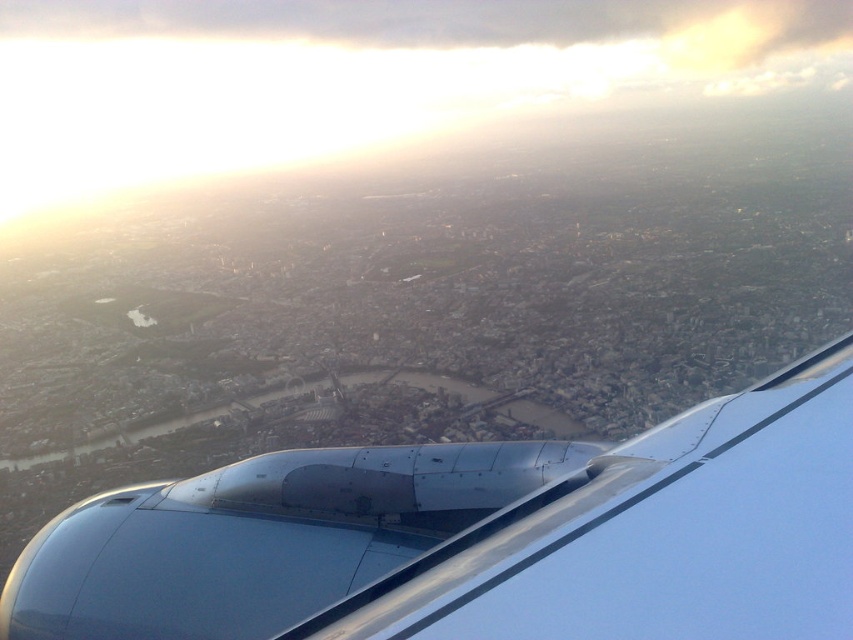
Question: Which point is farther from the camera taking this photo?

Choices:
 (A) (363, 467)
 (B) (453, 22)

Answer: (B)

Question: Where is metallic blue engine at lower right located in relation to transparent glass airplane window at lower left in the image?

Choices:
 (A) above
 (B) below

Answer: (B)

Question: Which object appears closest to the camera in this image?

Choices:
 (A) transparent glass airplane window at lower left
 (B) white fluffy cloud at upper center

Answer: (B)

Question: Which point is farther from the camera taking this photo?

Choices:
 (A) (111, 502)
 (B) (161, 524)
 (C) (112, 42)

Answer: (C)

Question: From the image, what is the correct spatial relationship of metallic blue engine at lower right in relation to white fluffy cloud at upper center?

Choices:
 (A) left
 (B) right

Answer: (B)

Question: Does white fluffy cloud at upper center have a lesser width compared to transparent glass airplane window at lower left?

Choices:
 (A) yes
 (B) no

Answer: (B)